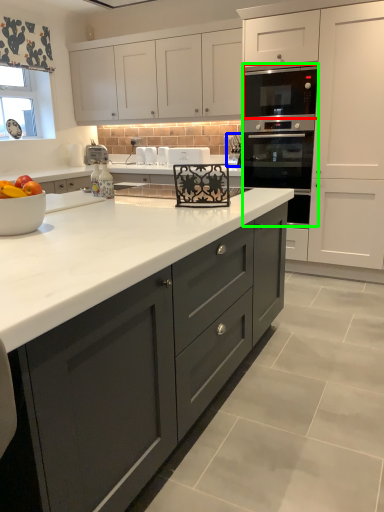
Question: Considering the real-world distances, which object is closest to appliance (highlighted by a red box)? appliance (highlighted by a blue box) or oven (highlighted by a green box).

Choices:
 (A) appliance
 (B) oven

Answer: (B)